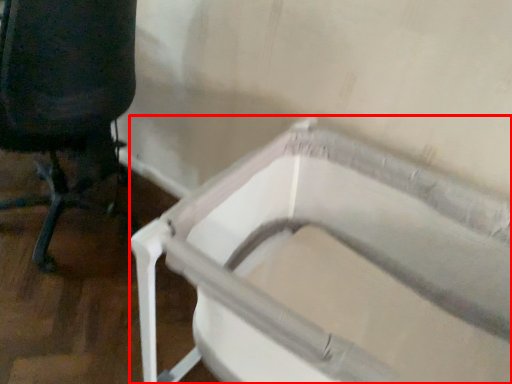
Question: From the image's perspective, where is bath (annotated by the red box) located in relation to chair in the image?

Choices:
 (A) below
 (B) above

Answer: (A)